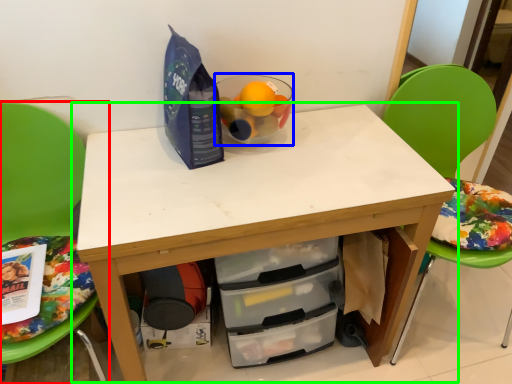
Question: Considering the real-world distances, which object is farthest from chair (highlighted by a red box)? bowl (highlighted by a blue box) or table (highlighted by a green box)?

Choices:
 (A) bowl
 (B) table

Answer: (A)